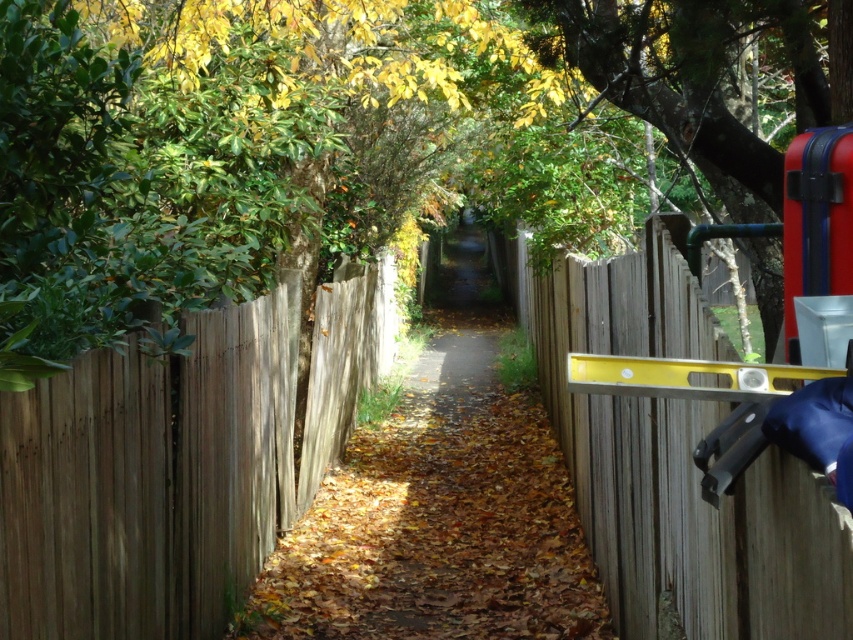
Question: Is wooden fence at right behind green leafy tree at upper right?

Choices:
 (A) no
 (B) yes

Answer: (A)

Question: Which is nearer to the wooden fence at right?

Choices:
 (A) green leafy tree at upper right
 (B) brown wooden fence at left

Answer: (A)

Question: Among these points, which one is nearest to the camera?

Choices:
 (A) (662, 392)
 (B) (236, 317)
 (C) (412, 536)
 (D) (758, 276)

Answer: (A)

Question: Is green leafy tree at upper right wider than yellow metallic level at right?

Choices:
 (A) no
 (B) yes

Answer: (B)

Question: Which of these objects is positioned closest to the brown wooden path at center?

Choices:
 (A) yellow metallic level at right
 (B) green leafy tree at upper right
 (C) wooden fence at right
 (D) brown wooden fence at left

Answer: (C)

Question: Does brown wooden fence at left have a larger size compared to green leafy tree at upper right?

Choices:
 (A) no
 (B) yes

Answer: (A)